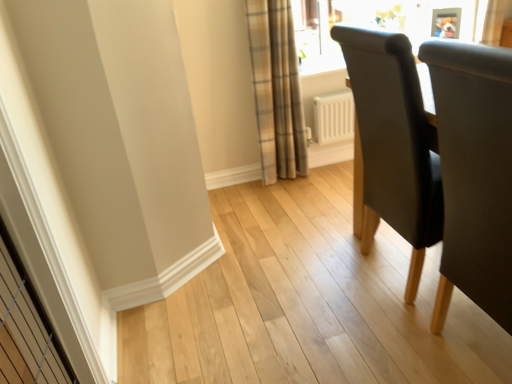
Image resolution: width=512 pixels, height=384 pixels. In order to click on vacant space to the left of plaid fabric curtain at upper center in this screenshot , I will do `click(239, 194)`.